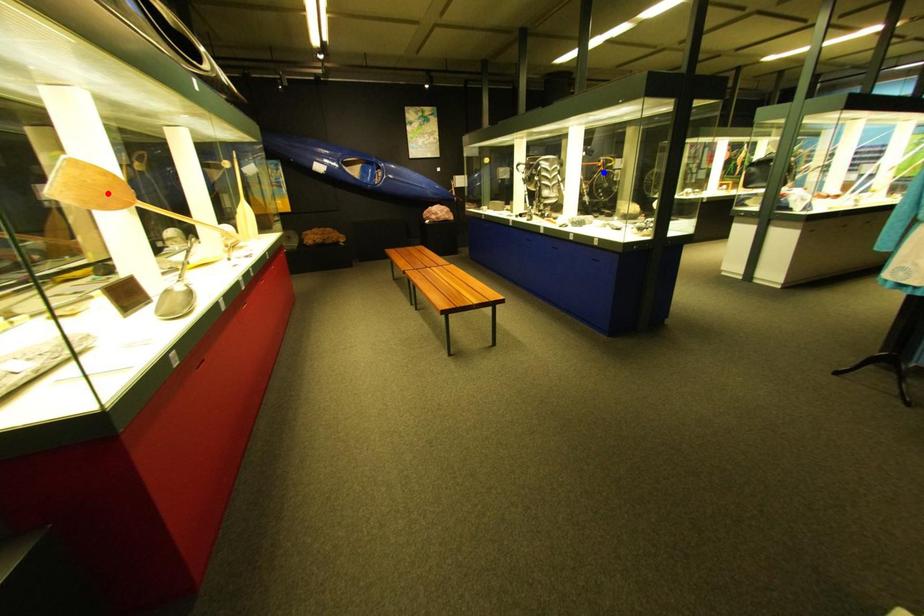
Question: Which of the two points in the image is closer to the camera?

Choices:
 (A) Blue point is closer.
 (B) Red point is closer.

Answer: (B)